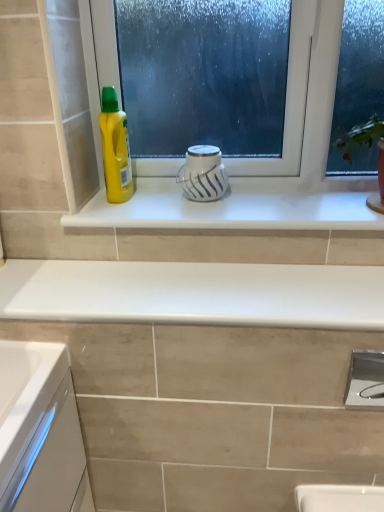
Where is `free space in front of white glossy mug at center`? Image resolution: width=384 pixels, height=512 pixels. free space in front of white glossy mug at center is located at coordinates [207, 212].